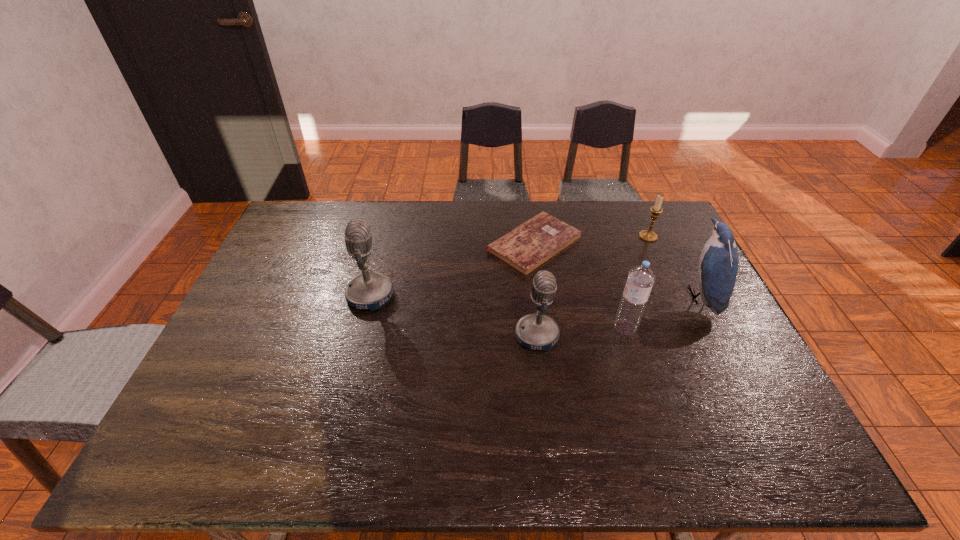
Find the location of `free space that is in between the taller microphone and the third object from right to left`. free space that is in between the taller microphone and the third object from right to left is located at coordinates 498,312.

Identify the location of blank region between the nearer microphone and the second shortest object. This screenshot has width=960, height=540. (592, 286).

Identify the location of free space between the shortest object and the rightmost object. (617, 270).

Where is `vacant area that lies between the second object from right to left and the rightmost object`? This screenshot has width=960, height=540. vacant area that lies between the second object from right to left and the rightmost object is located at coordinates (674, 266).

Identify the location of vacant area that lies between the bird and the third object from right to left. (662, 312).

This screenshot has height=540, width=960. Find the location of `the second closest object to the leftmost object`. the second closest object to the leftmost object is located at coordinates (537, 331).

At what (x,y) coordinates should I click in order to perform the action: click on object that is the second closest to the shorter microphone. Please return your answer as a coordinate pair (x, y). Looking at the image, I should click on (525, 248).